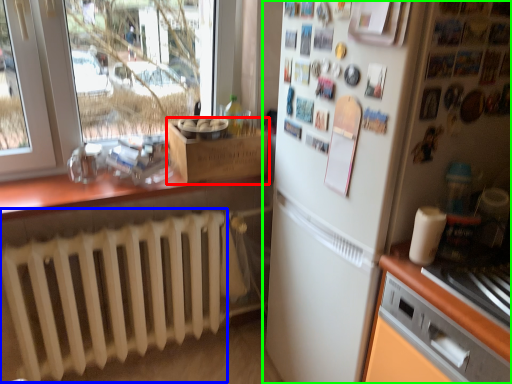
Question: Estimate the real-world distances between objects in this image. Which object is closer to cardboard box (highlighted by a red box), radiator (highlighted by a blue box) or refrigerator (highlighted by a green box)?

Choices:
 (A) radiator
 (B) refrigerator

Answer: (A)